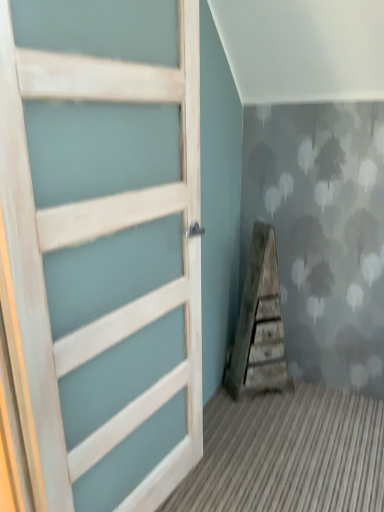
This screenshot has width=384, height=512. Identify the location of free point to the right of weathered wood staircase at center. (313, 398).